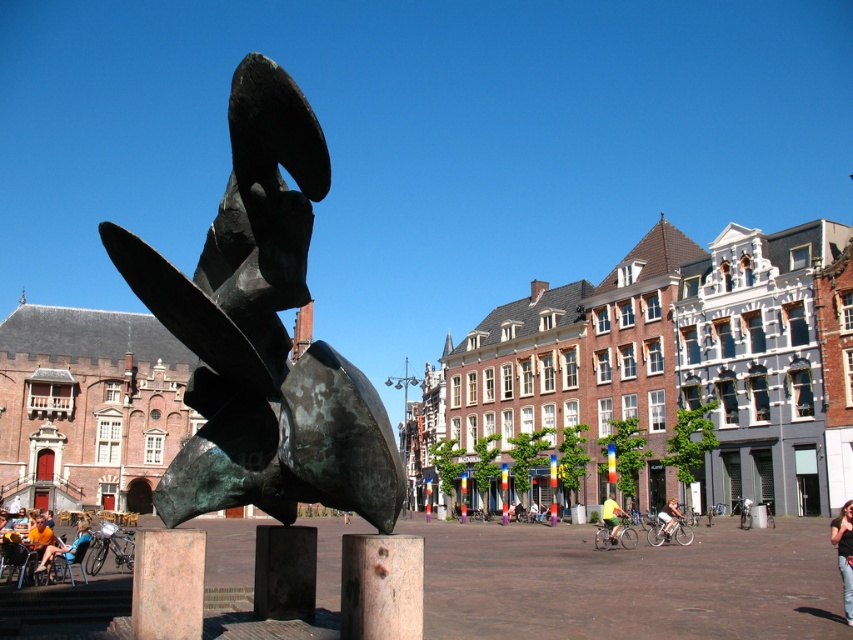
Question: Which point is farther to the camera?

Choices:
 (A) orange t-shirt at lower left
 (B) bronze abstract sculpture at center
 (C) blue fabric jacket at center

Answer: (A)

Question: In this image, where is orange t-shirt at lower left located relative to yellow fabric cyclist at center?

Choices:
 (A) right
 (B) left

Answer: (B)

Question: In this image, where is blue fabric jacket at center located relative to yellow fabric cyclist at center?

Choices:
 (A) left
 (B) right

Answer: (A)

Question: Which object is positioned farthest from the yellow fabric cyclist at center?

Choices:
 (A) orange t-shirt at lower left
 (B) denim pants at lower right
 (C) blue fabric jacket at center

Answer: (C)

Question: Among these points, which one is farthest from the camera?

Choices:
 (A) (155, 257)
 (B) (44, 568)
 (C) (844, 605)

Answer: (B)

Question: Does bronze abstract sculpture at center lie in front of blue fabric jacket at center?

Choices:
 (A) yes
 (B) no

Answer: (A)